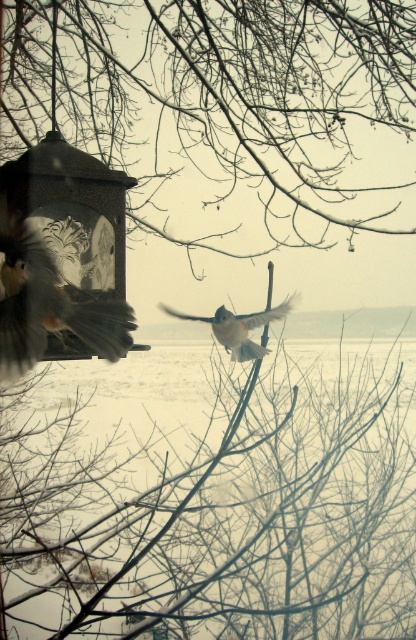
Question: Which object is positioned closest to the blurred feathers bird at left?

Choices:
 (A) white fluffy bird at center
 (B) smooth bark tree at center

Answer: (A)

Question: From the image, what is the correct spatial relationship of smooth bark tree at center in relation to white fluffy bird at center?

Choices:
 (A) right
 (B) left

Answer: (B)

Question: Which point is farther from the camera taking this photo?

Choices:
 (A) click(x=34, y=253)
 (B) click(x=227, y=332)

Answer: (B)

Question: Can you confirm if smooth bark tree at center is wider than white fluffy bird at center?

Choices:
 (A) yes
 (B) no

Answer: (A)

Question: From the image, what is the correct spatial relationship of smooth bark tree at center in relation to blurred feathers bird at left?

Choices:
 (A) below
 (B) above

Answer: (B)

Question: Estimate the real-world distances between objects in this image. Which object is closer to the blurred feathers bird at left?

Choices:
 (A) smooth bark tree at center
 (B) white fluffy bird at center

Answer: (B)